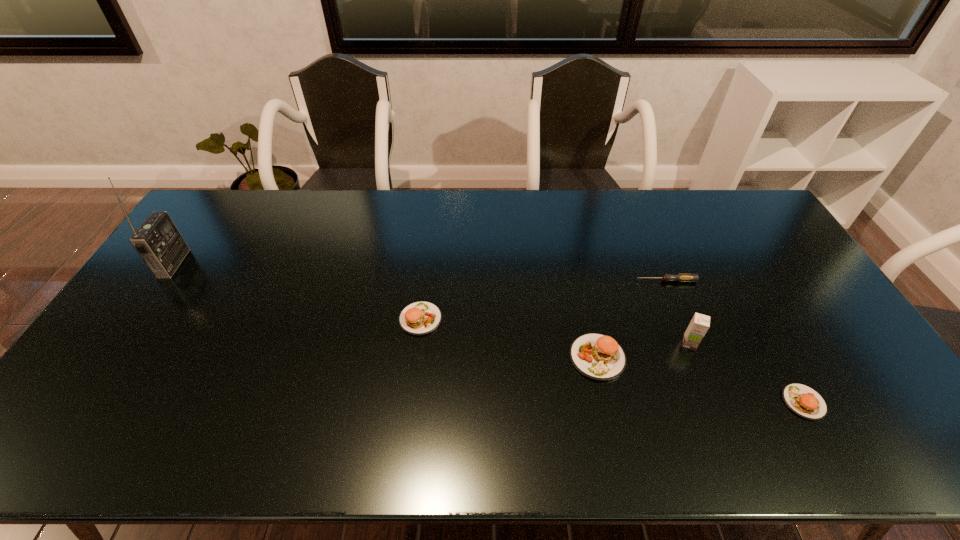
Please point a vacant point for placing a patty on the left. Please provide its 2D coordinates. Your answer should be formatted as a tuple, i.e. [(x, y)], where the tuple contains the x and y coordinates of a point satisfying the conditions above.

[(267, 286)]